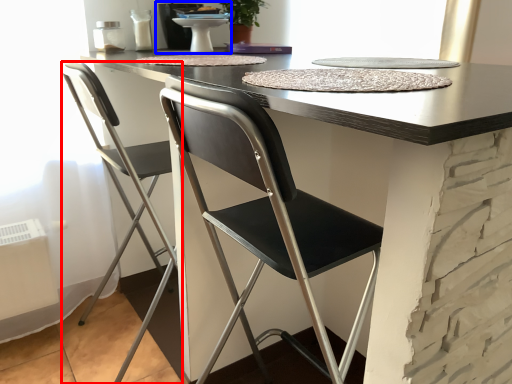
Question: Which object appears farthest to the camera in this image, chair (highlighted by a red box) or sink (highlighted by a blue box)?

Choices:
 (A) chair
 (B) sink

Answer: (B)